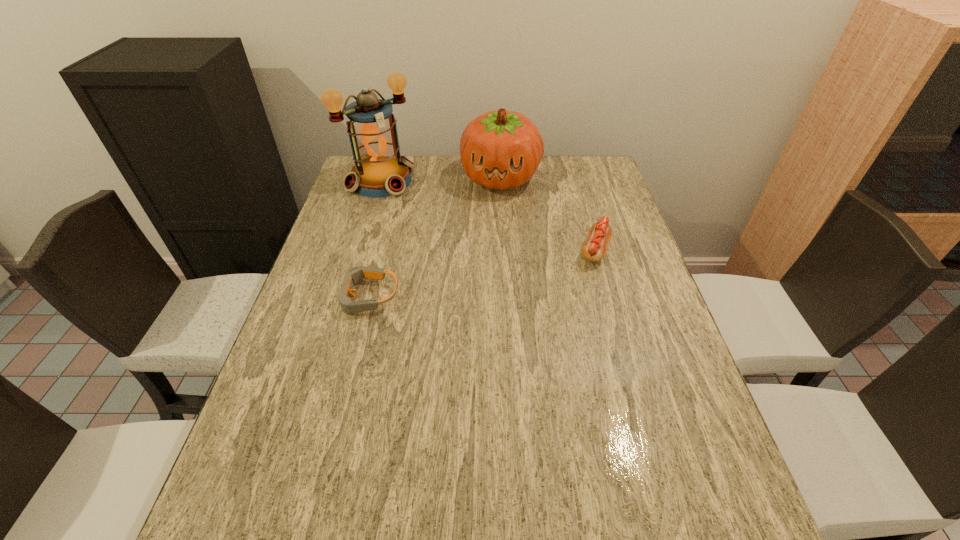
Image resolution: width=960 pixels, height=540 pixels. What are the coordinates of `vacant space on the desktop that is between the nearest object and the second nearest object and is positioned on the side of the pumpkin with the cute face` in the screenshot? It's located at (479, 274).

Image resolution: width=960 pixels, height=540 pixels. Identify the location of free space on the desktop that is between the shortest object and the second nearest object and is positioned on the front-facing side of the lantern. (486, 272).